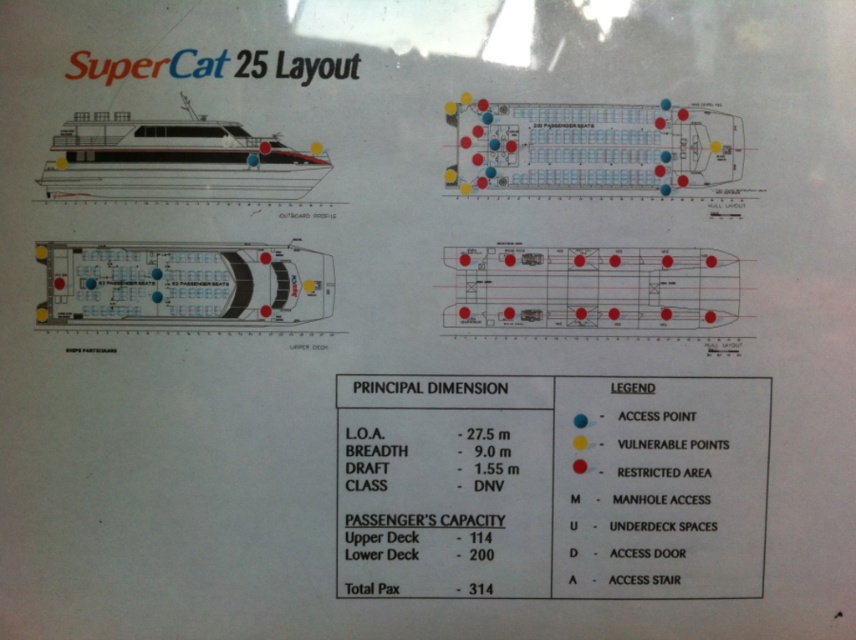
Question: Which object appears closest to the camera in this image?

Choices:
 (A) white plastic boat at center
 (B) white glossy ship at upper left

Answer: (B)

Question: Which of the following is the farthest from the observer?

Choices:
 (A) (206, 252)
 (B) (241, 173)

Answer: (A)

Question: Does white plastic boat at center appear on the right side of white glossy ship at upper left?

Choices:
 (A) yes
 (B) no

Answer: (B)

Question: Can you confirm if white plastic boat at center is positioned above white glossy ship at upper left?

Choices:
 (A) no
 (B) yes

Answer: (A)

Question: Can you confirm if white plastic boat at center is positioned to the right of white glossy ship at upper left?

Choices:
 (A) yes
 (B) no

Answer: (B)